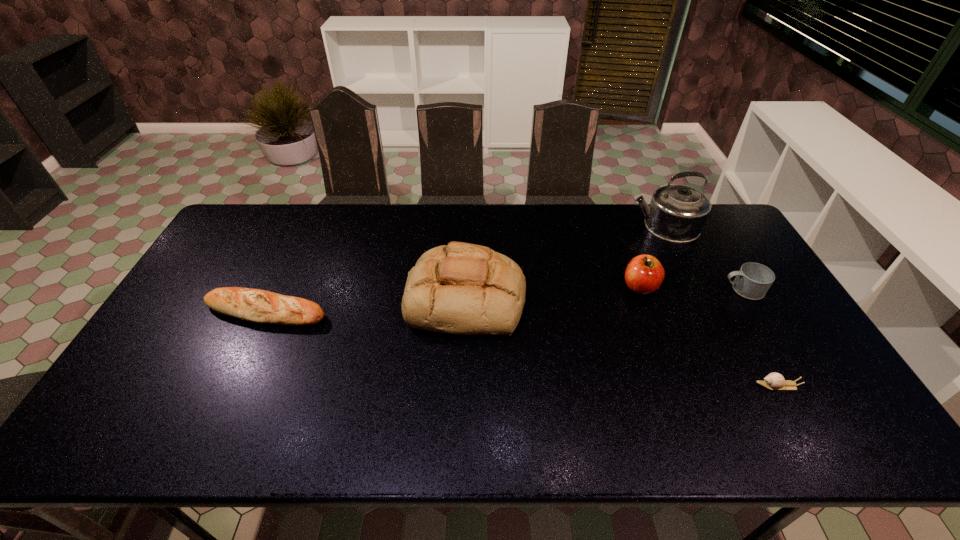
The height and width of the screenshot is (540, 960). In the image, there is a desktop. Find the location of `free space at the right edge`. free space at the right edge is located at coordinates (833, 384).

At what (x,y) coordinates should I click in order to perform the action: click on free space at the near left corner. Please return your answer as a coordinate pair (x, y). The width and height of the screenshot is (960, 540). Looking at the image, I should click on (111, 429).

At what (x,y) coordinates should I click in order to perform the action: click on empty space between the kettle and the mug. Please return your answer as a coordinate pair (x, y). The height and width of the screenshot is (540, 960). Looking at the image, I should click on (704, 258).

This screenshot has height=540, width=960. In order to click on vacant point located between the second tallest object and the leftmost object in this screenshot , I will do `click(366, 305)`.

You are a GUI agent. You are given a task and a screenshot of the screen. Output one action in this format:
    pyautogui.click(x=<x>, y=<y>)
    Task: Click on the unoccupied position between the bread and the nearest object
    
    Given the screenshot: What is the action you would take?
    pyautogui.click(x=622, y=342)

The height and width of the screenshot is (540, 960). What are the coordinates of `free point between the apple and the second tallest object` in the screenshot? It's located at (553, 293).

Find the location of a particular element. free space between the apple and the fifth shortest object is located at coordinates (553, 293).

Image resolution: width=960 pixels, height=540 pixels. I want to click on free space that is in between the second tallest object and the tallest object, so click(564, 262).

You are a GUI agent. You are given a task and a screenshot of the screen. Output one action in this format:
    pyautogui.click(x=<x>, y=<y>)
    Task: Click on the empty space between the fourth shortest object and the shortest object
    The height and width of the screenshot is (540, 960).
    Given the screenshot: What is the action you would take?
    pyautogui.click(x=708, y=336)

Where is `free spot between the third tallest object and the bread`? This screenshot has height=540, width=960. free spot between the third tallest object and the bread is located at coordinates (553, 293).